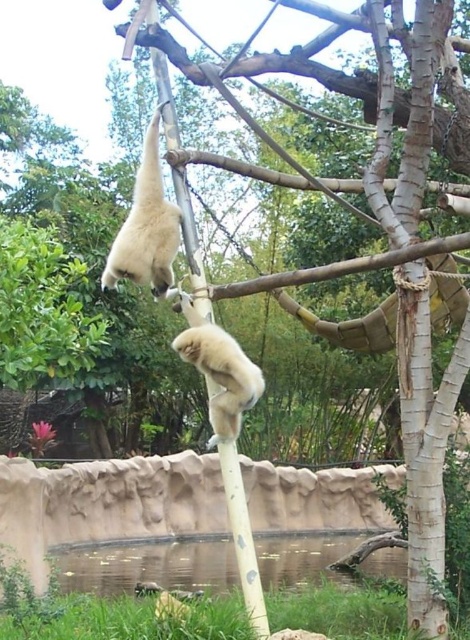
Can you confirm if white matte pole at center is shorter than fuzzy white monkey at center?

No, white matte pole at center is not shorter than fuzzy white monkey at center.

Is white matte pole at center below fuzzy white monkey at center?

Indeed, white matte pole at center is positioned under fuzzy white monkey at center.

Identify the location of white matte pole at center. The image size is (470, 640). (242, 538).

Is white fur monkey at upper center to the right of fuzzy white monkey at center from the viewer's perspective?

No, white fur monkey at upper center is not to the right of fuzzy white monkey at center.

Where is `white fur monkey at upper center`? white fur monkey at upper center is located at coordinates (147, 227).

Identify the location of white fur monkey at upper center. Image resolution: width=470 pixels, height=640 pixels. (147, 227).

Can you confirm if white matte pole at center is positioned below white fur monkey at upper center?

Correct, white matte pole at center is located below white fur monkey at upper center.

Does white matte pole at center have a lesser height compared to white fur monkey at upper center?

Incorrect, white matte pole at center's height does not fall short of white fur monkey at upper center's.

Between point (187, 225) and point (148, 237), which one is positioned behind?

The point (187, 225) is behind.

Identify the location of white matte pole at center. This screenshot has height=640, width=470. (242, 538).